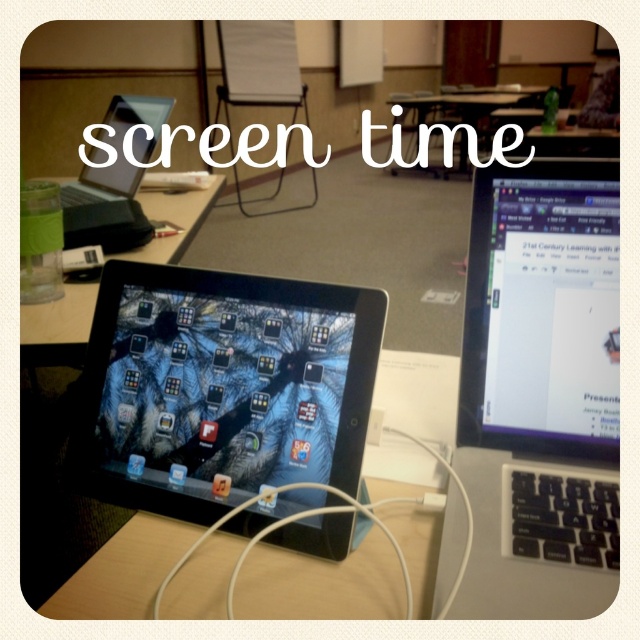
You are a student who needs to reach for both the sleek black laptop at right and the clear plastic water bottle at upper left during a presentation. Can you comfortably reach both items without moving your chair? The average arm span for a student is 34 inches.

The distance between the sleek black laptop at right and the clear plastic water bottle at upper left is 36.64 inches. Since the average arm span is 34 inches, the student may not comfortably reach both items without moving their chair.

You are a student sitting at the desk in the classroom. You need to reach for the clear plastic water bottle at upper left but first want to check its position relative to the matte black tablet at center. Which object is positioned to the left?

The matte black tablet at center is to the left of the clear plastic water bottle at upper left, so the matte black tablet at center is positioned to the left.